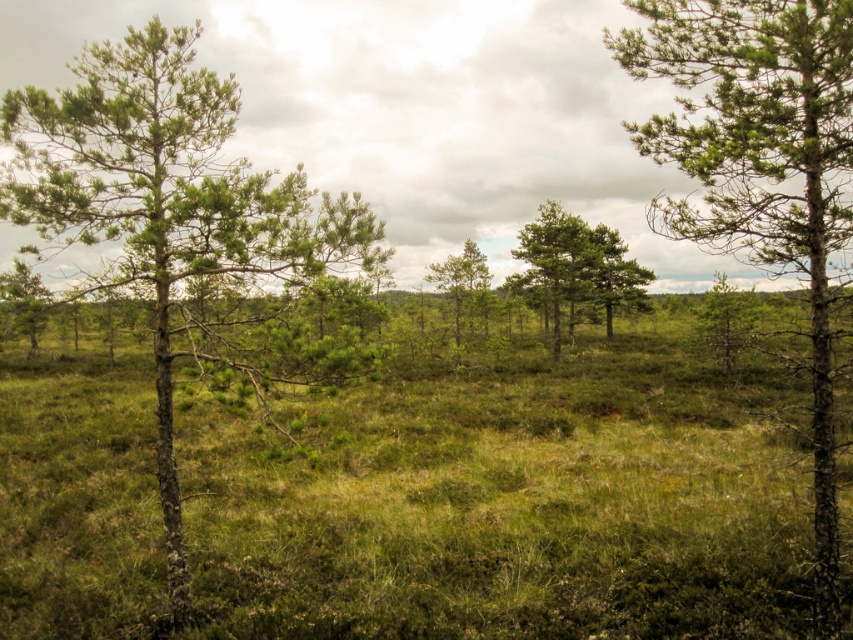
Between green rough bark tree at left and green matte tree at center, which one has more height?

With more height is green rough bark tree at left.

Measure the distance between point (206, 77) and camera.

26.18 feet

Which is in front, point (193, 72) or point (451, 291)?

Point (193, 72) is in front.

Identify the location of green rough bark tree at left. The width and height of the screenshot is (853, 640). (161, 198).

How much distance is there between green textured tree at center and green matte tree at center?

The distance of green textured tree at center from green matte tree at center is 3.76 meters.

Can you confirm if green textured tree at center is positioned to the right of green matte tree at center?

Indeed, green textured tree at center is positioned on the right side of green matte tree at center.

Between point (572, 268) and point (476, 266), which one is positioned behind?

Point (476, 266)

You are a GUI agent. You are given a task and a screenshot of the screen. Output one action in this format:
    pyautogui.click(x=<x>, y=<y>)
    Task: Click on the green textured tree at center
    This screenshot has width=853, height=640.
    Given the screenshot: What is the action you would take?
    pyautogui.click(x=578, y=268)

Which is behind, point (86, 129) or point (825, 112)?

The point (86, 129) is behind.

Between green rough bark tree at left and green textured tree at right, which one is positioned higher?

green textured tree at right is above.

Does point (302, 204) come in front of point (631, 124)?

Yes, point (302, 204) is closer to viewer.

The height and width of the screenshot is (640, 853). What are the coordinates of `green rough bark tree at left` in the screenshot? It's located at (161, 198).